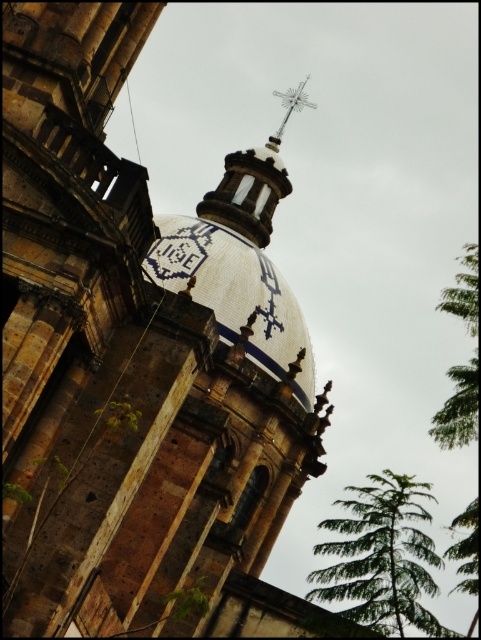
Between point (388, 579) and point (163, 221), which one is positioned behind?

The point (163, 221) is behind.

Identify the location of green needle-like tree at right. (380, 557).

Is point (415, 541) farther from camera compared to point (438, 428)?

No, it is in front of (438, 428).

Is point (342, 627) less distant than point (467, 428)?

That is True.

Locate an element on the screen. green needle-like tree at right is located at coordinates (380, 557).

Does green needle-like tree at right have a smaller size compared to silver metallic cross at upper center?

Actually, green needle-like tree at right might be larger than silver metallic cross at upper center.

In the scene shown: Does green needle-like tree at right have a lesser height compared to silver metallic cross at upper center?

No, green needle-like tree at right is not shorter than silver metallic cross at upper center.

Identify the location of green needle-like tree at right. The height and width of the screenshot is (640, 481). (380, 557).